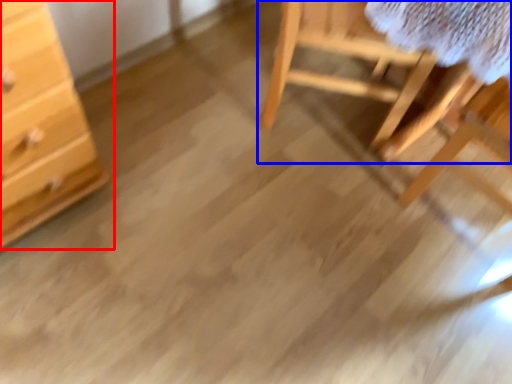
Question: Which object is further to the camera taking this photo, chest of drawers (highlighted by a red box) or furniture (highlighted by a blue box)?

Choices:
 (A) chest of drawers
 (B) furniture

Answer: (B)